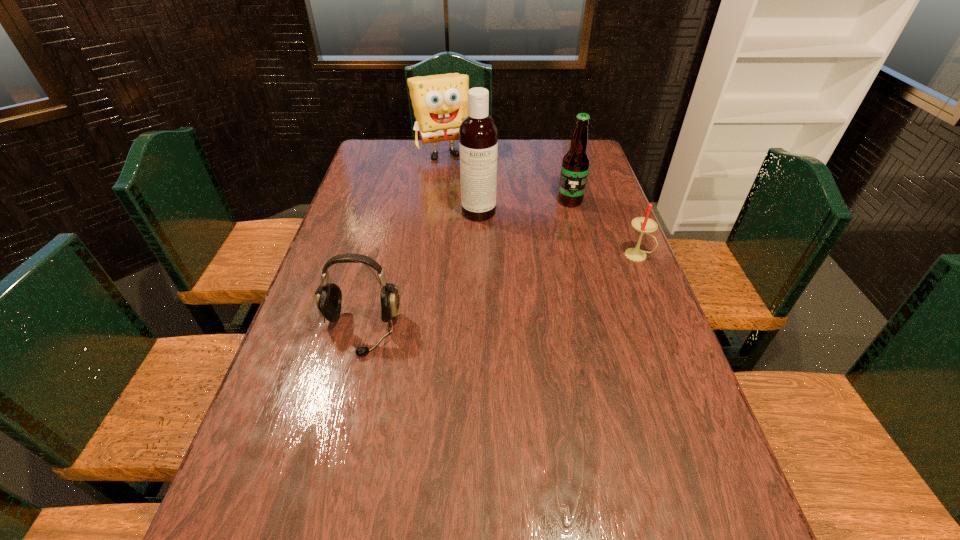
I want to click on vacant region that satisfies the following two spatial constraints: 1. on the front side of the dishwasher detergent; 2. on the left side of the second nearest object, so click(478, 255).